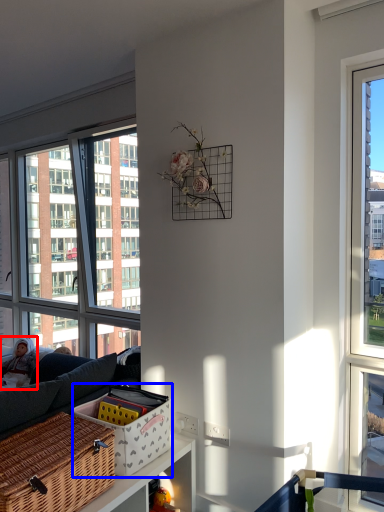
Question: Which point is further to the camera, couple (highlighted by a red box) or basket (highlighted by a blue box)?

Choices:
 (A) couple
 (B) basket

Answer: (A)